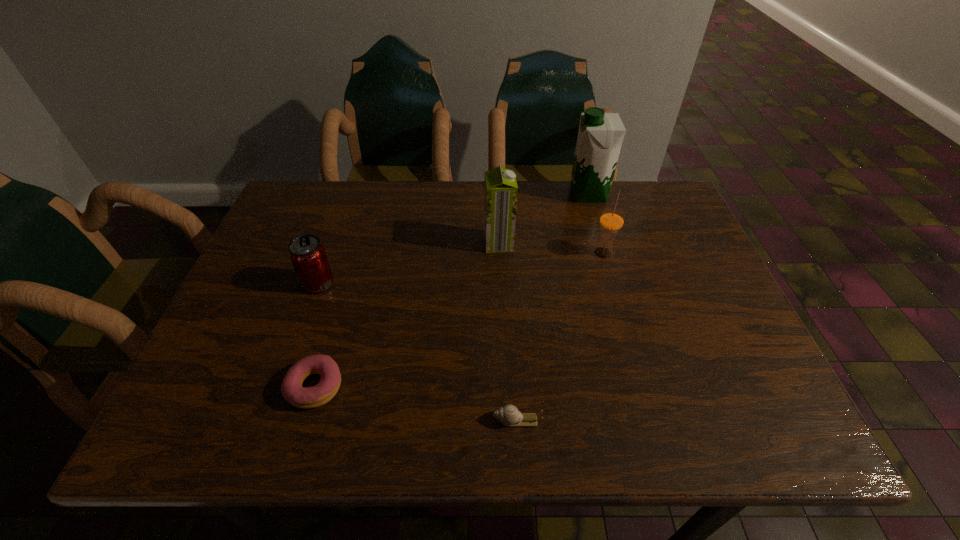
At what (x,y) coordinates should I click in order to perform the action: click on the right soya milk. Please return your answer as a coordinate pair (x, y). This screenshot has height=540, width=960. Looking at the image, I should click on (600, 136).

Where is `the farther soya milk`? the farther soya milk is located at coordinates (600, 136).

Where is `the left soya milk`? the left soya milk is located at coordinates (500, 187).

The width and height of the screenshot is (960, 540). I want to click on the shorter soya milk, so click(x=500, y=187).

At what (x,y) coordinates should I click in order to perform the action: click on straw. Please return your answer as a coordinate pair (x, y). This screenshot has width=960, height=540. Looking at the image, I should click on (612, 219).

I want to click on pop soda, so point(308,256).

Locate an element on the screen. the third nearest object is located at coordinates (308, 256).

Identify the location of doughnut. (302, 397).

Find the location of `escargot`. escargot is located at coordinates (508, 415).

Where is `vacant area situated on the front-facing side of the right soya milk`? The width and height of the screenshot is (960, 540). vacant area situated on the front-facing side of the right soya milk is located at coordinates (539, 194).